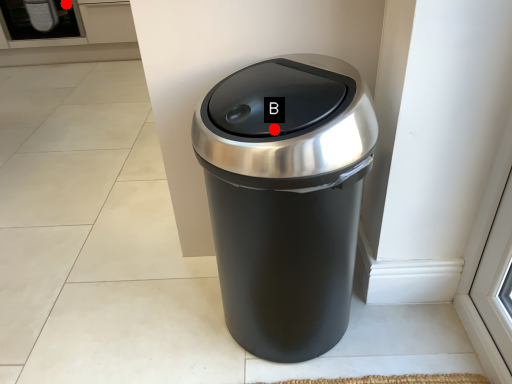
Question: Two points are circled on the image, labeled by A and B beside each circle. Which point is further to the camera?

Choices:
 (A) A is further
 (B) B is further

Answer: (A)